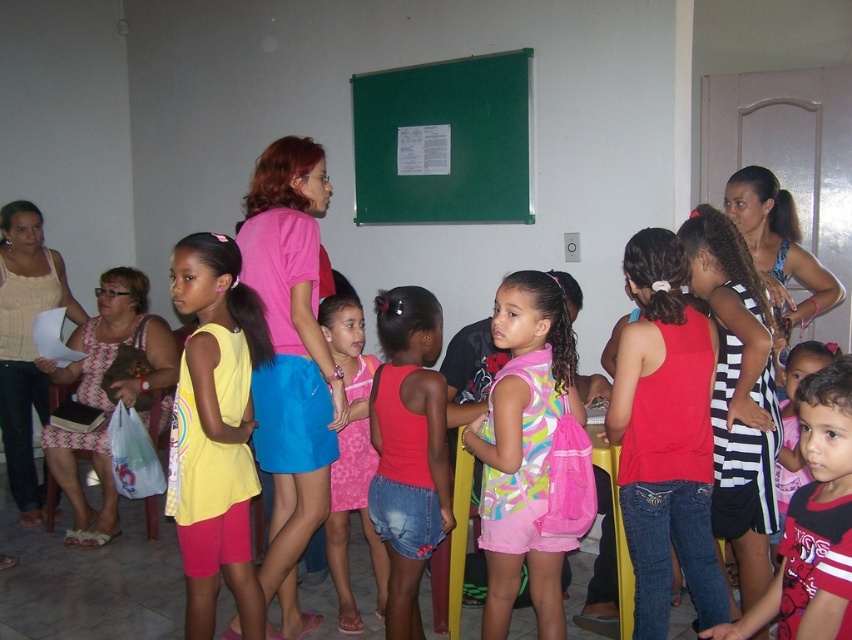
The image size is (852, 640). Describe the element at coordinates (216, 432) in the screenshot. I see `yellow fabric shirt at center` at that location.

Does point (181, 252) lie in front of point (839, 529)?

No, it is behind (839, 529).

The image size is (852, 640). I want to click on yellow fabric shirt at center, so click(x=216, y=432).

Is pink denim shorts at center above pink lace dress at center?

Correct, pink denim shorts at center is located above pink lace dress at center.

Between point (419, 436) and point (340, 326), which one is positioned in front?

Point (419, 436) is in front.

Which is behind, point (399, 618) or point (361, 384)?

The point (361, 384) is more distant.

At what (x,y) coordinates should I click in order to perform the action: click on pink denim shorts at center. Please return your answer as a coordinate pair (x, y). This screenshot has height=640, width=852. Looking at the image, I should click on (407, 449).

Between point (373, 74) and point (787, 589), which one is positioned behind?

Positioned behind is point (373, 74).

Is point (355, 208) positioned before point (842, 461)?

No.

Where is `green matte/blackboard at upper center`? Image resolution: width=852 pixels, height=640 pixels. green matte/blackboard at upper center is located at coordinates (442, 141).